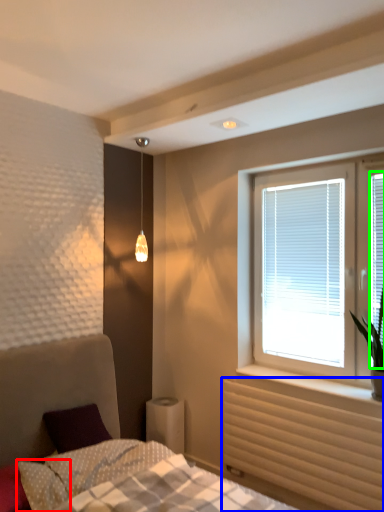
Question: Estimate the real-world distances between objects in this image. Which object is closer to pillow (highlighted by a red box), radiator (highlighted by a blue box) or window screen (highlighted by a green box)?

Choices:
 (A) radiator
 (B) window screen

Answer: (A)